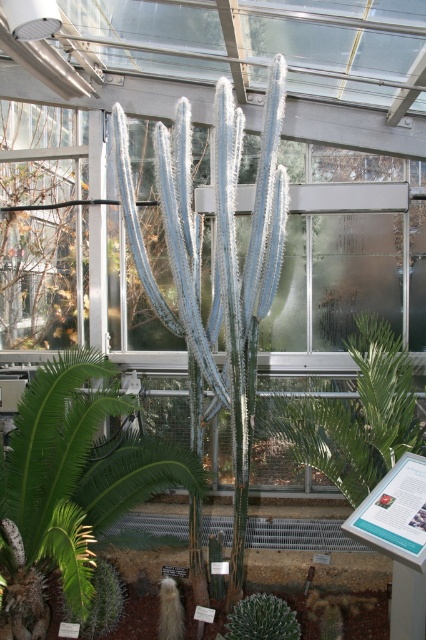
Who is more distant from viewer, (176, 461) or (81, 627)?

The point (176, 461) is behind.

Is green spiky cactus at center smaller than green spiky cactus at lower left?

No.

Who is more forward, (106, 465) or (97, 582)?

Point (97, 582) is more forward.

Find the location of a particular element. green spiky cactus at center is located at coordinates (69, 486).

Can you confirm if green leafy plant at center is wider than green fuzzy cactus at center?

Indeed, green leafy plant at center has a greater width compared to green fuzzy cactus at center.

Between point (370, 339) and point (229, 616), which one is positioned in front?

Point (229, 616)

Where is `green leafy plant at center`? The height and width of the screenshot is (640, 426). green leafy plant at center is located at coordinates (354, 416).

Can you confirm if green spiky cactus at center is taller than green fuzzy cactus at center?

Indeed, green spiky cactus at center has a greater height compared to green fuzzy cactus at center.

Which is more to the left, green spiky cactus at center or green fuzzy cactus at center?

From the viewer's perspective, green spiky cactus at center appears more on the left side.

Identify the location of green spiky cactus at center. 69,486.

Find the location of a particular element. The height and width of the screenshot is (640, 426). green spiky cactus at center is located at coordinates (69, 486).